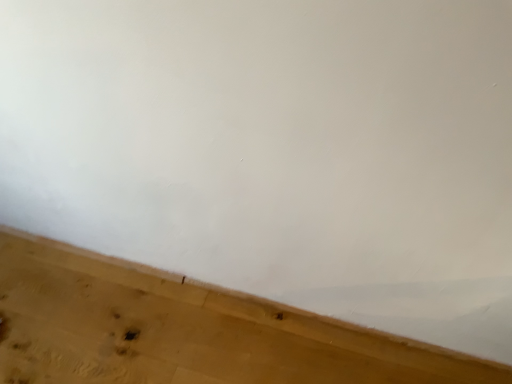
Measure the distance between natural wood floor at bottom and camera.

natural wood floor at bottom and camera are 3.71 feet apart from each other.

The width and height of the screenshot is (512, 384). What do you see at coordinates (184, 331) in the screenshot?
I see `natural wood floor at bottom` at bounding box center [184, 331].

Find the location of `natural wood floor at bottom`. natural wood floor at bottom is located at coordinates (184, 331).

Measure the distance between point (x=166, y=284) and camera.

Point (x=166, y=284) and camera are 4.44 feet apart.

Find the location of a particular element. The width and height of the screenshot is (512, 384). natural wood floor at bottom is located at coordinates (184, 331).